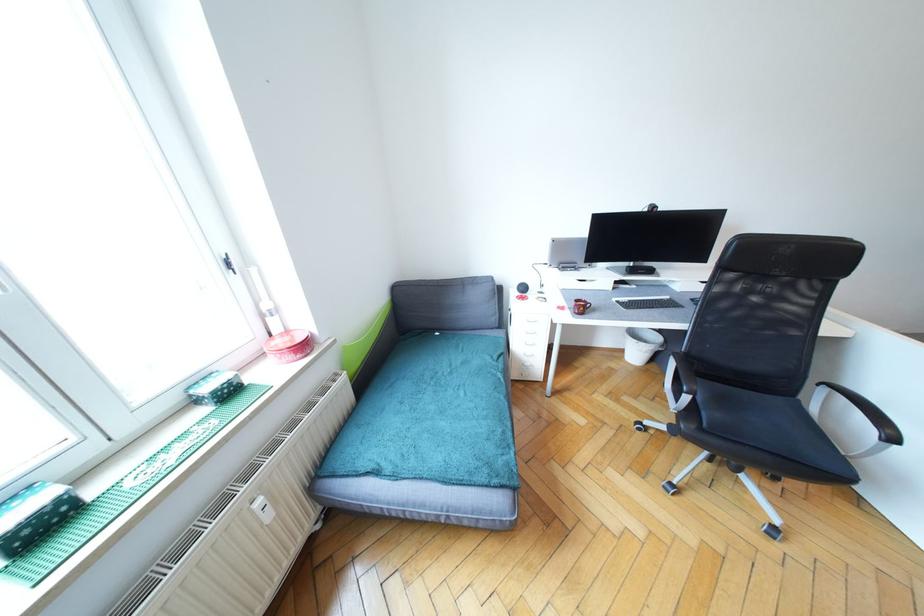
Find where to sit the sofa sitting surface. Please return your answer as a coordinate pair (x, y).

(438, 493)